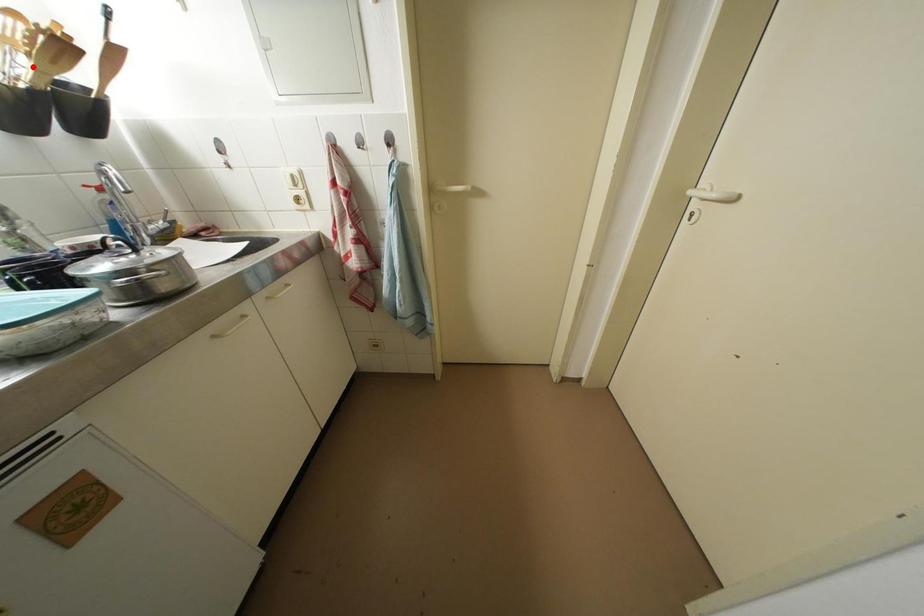
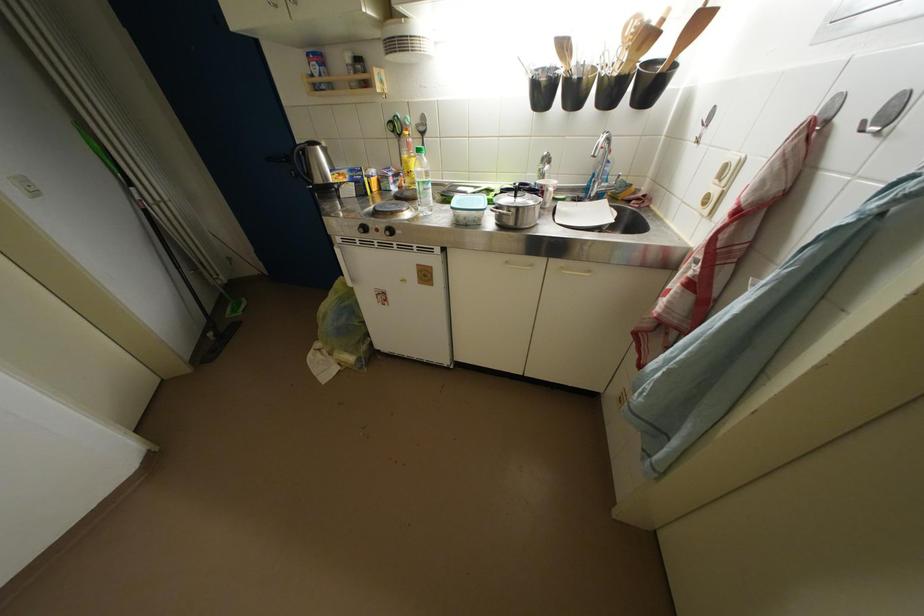
Find the pixel in the second image that matches the highlighted location in the first image.

(631, 60)